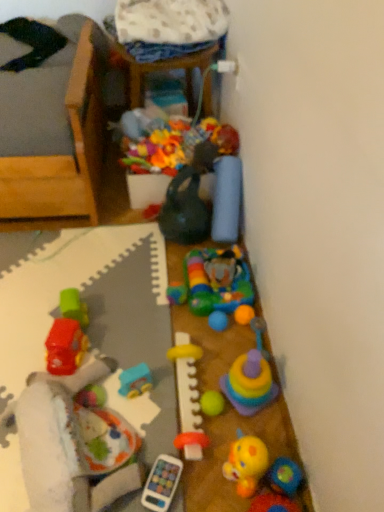
What are the coordinates of `vacant space that's between matte green kettle at center, the 3th toy from the left, and rubberized plastic baby rattle at lower left, arranged as the first toy when viewed from the left` in the screenshot? It's located at (136, 303).